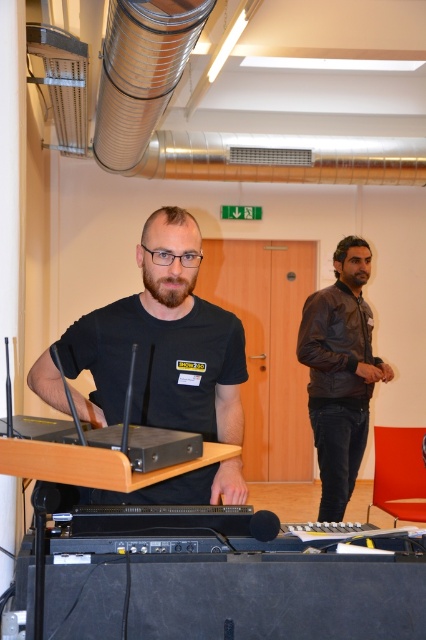
Question: Which of the following is the closest to the observer?

Choices:
 (A) (160, 467)
 (B) (143, 288)
 (C) (357, 408)

Answer: (A)

Question: Can you confirm if black matte t-shirt at center is wider than leather jacket at right?

Choices:
 (A) no
 (B) yes

Answer: (B)

Question: Where is leather jacket at right located in relation to black plastic laptop at center in the image?

Choices:
 (A) right
 (B) left

Answer: (A)

Question: Which object appears farthest from the camera in this image?

Choices:
 (A) leather jacket at right
 (B) black plastic laptop at center

Answer: (A)

Question: Which of these objects is positioned farthest from the black matte t-shirt at center?

Choices:
 (A) black plastic laptop at center
 (B) leather jacket at right

Answer: (B)

Question: Does black matte t-shirt at center appear on the left side of black plastic laptop at center?

Choices:
 (A) yes
 (B) no

Answer: (A)